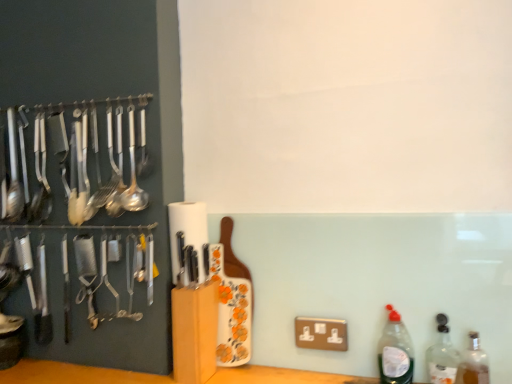
Question: From a real-world perspective, does translucent plastic bottle at lower right, acting as the 1th bottle starting from the left, stand above clear glass bottle at right, placed as the second bottle when sorted from left to right?

Choices:
 (A) yes
 (B) no

Answer: (A)

Question: From the image's perspective, is translucent plastic bottle at lower right, acting as the 1th bottle starting from the left, above clear glass bottle at right, placed as the 2th bottle when sorted from right to left?

Choices:
 (A) no
 (B) yes

Answer: (B)

Question: Is translucent plastic bottle at lower right, acting as the 1th bottle starting from the left, at the right side of clear glass bottle at right, placed as the 2th bottle when sorted from right to left?

Choices:
 (A) yes
 (B) no

Answer: (B)

Question: Does translucent plastic bottle at lower right, which is the third bottle in right-to-left order, come behind clear glass bottle at right, placed as the second bottle when sorted from left to right?

Choices:
 (A) yes
 (B) no

Answer: (A)

Question: Considering the relative sizes of translucent plastic bottle at lower right, which is the third bottle in right-to-left order, and clear glass bottle at right, placed as the 2th bottle when sorted from right to left, in the image provided, is translucent plastic bottle at lower right, which is the third bottle in right-to-left order, smaller than clear glass bottle at right, placed as the 2th bottle when sorted from right to left,?

Choices:
 (A) no
 (B) yes

Answer: (A)

Question: Is clear glass bottle at right, placed as the second bottle when sorted from left to right, a part of translucent plastic bottle at lower right, which is the third bottle in right-to-left order?

Choices:
 (A) no
 (B) yes

Answer: (A)

Question: Is the depth of translucent plastic bottle at lower right, acting as the 1th bottle starting from the left, greater than that of translucent glass bottle at lower right, marked as the 1th bottle in a right-to-left arrangement?

Choices:
 (A) yes
 (B) no

Answer: (A)

Question: Considering the relative sizes of translucent plastic bottle at lower right, which is the third bottle in right-to-left order, and translucent glass bottle at lower right, marked as the 1th bottle in a right-to-left arrangement, in the image provided, is translucent plastic bottle at lower right, which is the third bottle in right-to-left order, taller than translucent glass bottle at lower right, marked as the 1th bottle in a right-to-left arrangement,?

Choices:
 (A) yes
 (B) no

Answer: (A)

Question: From a real-world perspective, is translucent plastic bottle at lower right, which is the third bottle in right-to-left order, located higher than translucent glass bottle at lower right, the 3th bottle from the left?

Choices:
 (A) yes
 (B) no

Answer: (A)

Question: Does translucent plastic bottle at lower right, which is the third bottle in right-to-left order, lie in front of translucent glass bottle at lower right, the 3th bottle from the left?

Choices:
 (A) no
 (B) yes

Answer: (A)

Question: Considering the relative sizes of translucent plastic bottle at lower right, which is the third bottle in right-to-left order, and translucent glass bottle at lower right, the 3th bottle from the left, in the image provided, is translucent plastic bottle at lower right, which is the third bottle in right-to-left order, smaller than translucent glass bottle at lower right, the 3th bottle from the left,?

Choices:
 (A) no
 (B) yes

Answer: (A)

Question: Does translucent plastic bottle at lower right, which is the third bottle in right-to-left order, appear on the right side of translucent glass bottle at lower right, marked as the 1th bottle in a right-to-left arrangement?

Choices:
 (A) no
 (B) yes

Answer: (A)

Question: Is the position of translucent glass bottle at lower right, marked as the 1th bottle in a right-to-left arrangement, more distant than that of translucent plastic bottle at lower right, which is the third bottle in right-to-left order?

Choices:
 (A) no
 (B) yes

Answer: (A)